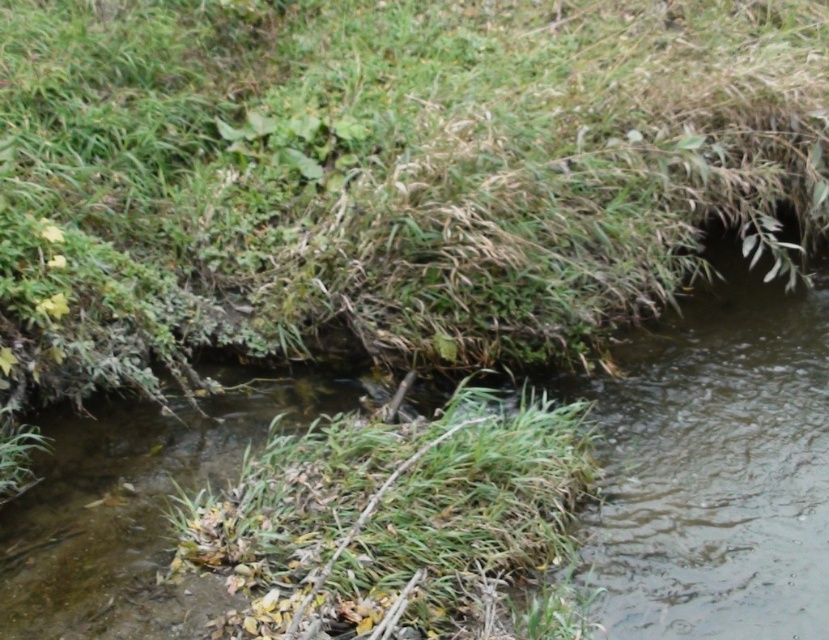
You are standing at the edge of the water body and want to cross to the other side. The clear water at center and green grass at center are in your path. Which one is higher and would require you to step up more?

The clear water at center is much taller than the green grass at center, so you would need to step up more over the clear water at center.

You are standing at the edge of the water and want to cross to the other side. The clear water at center and green grass at center are both in your path. Which one is wider, making it harder to step over?

The clear water at center is wider than the green grass at center, so it is harder to step over.